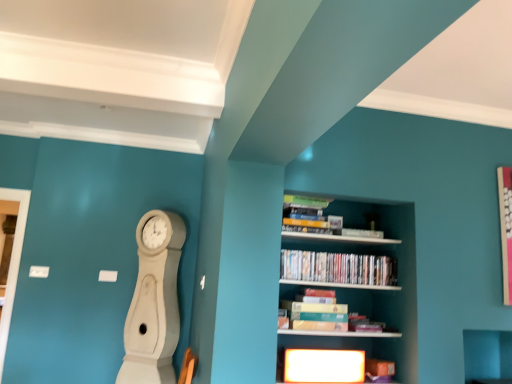
The height and width of the screenshot is (384, 512). I want to click on free space above matte plastic dvds at center, acting as the second book starting from the bottom (from a real-world perspective), so click(342, 253).